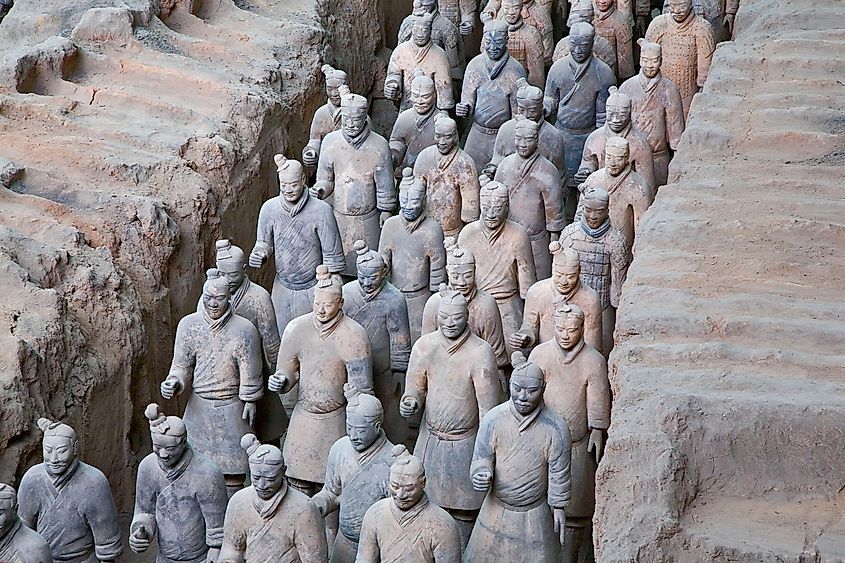
This screenshot has width=845, height=563. Identify the location of chest. (529, 444), (453, 367).